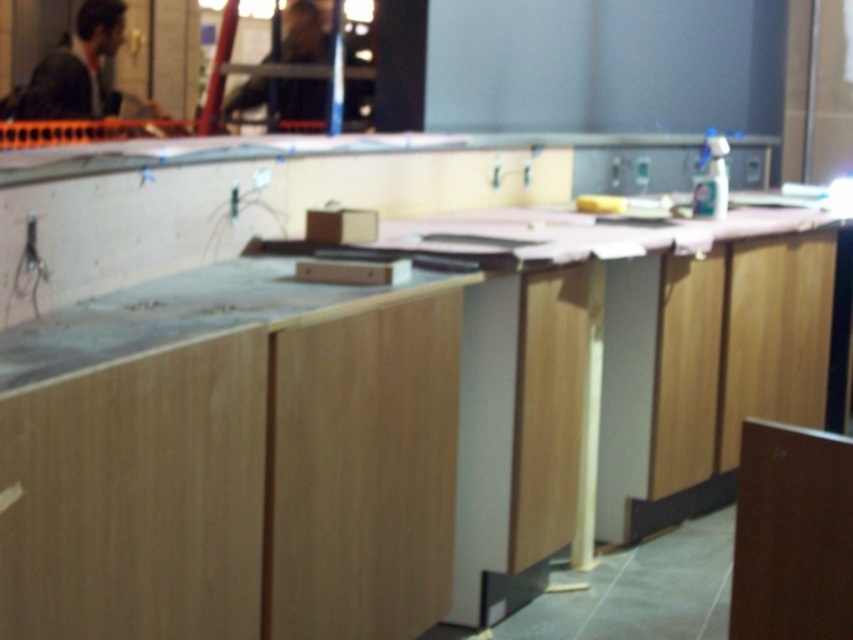
Who is taller, wooden counter at center or dark brown leather jacket at upper center?

With more height is wooden counter at center.

Which is more to the right, wooden counter at center or dark brown leather jacket at upper center?

Positioned to the right is wooden counter at center.

Locate an element on the screen. The height and width of the screenshot is (640, 853). wooden counter at center is located at coordinates (288, 452).

Measure the distance between point (80, 90) and camera.

Point (80, 90) and camera are 6.19 meters apart from each other.

Which is in front, point (39, 81) or point (253, 104)?

Point (253, 104) is in front.

Between point (90, 35) and point (271, 60), which one is positioned behind?

Positioned behind is point (90, 35).

Locate an element on the screen. The image size is (853, 640). matte black suit at upper left is located at coordinates (80, 74).

Does wooden counter at center appear on the right side of matte black suit at upper left?

Indeed, wooden counter at center is positioned on the right side of matte black suit at upper left.

At what (x,y) coordinates should I click in order to perform the action: click on wooden counter at center. Please return your answer as a coordinate pair (x, y). The height and width of the screenshot is (640, 853). Looking at the image, I should click on (288, 452).